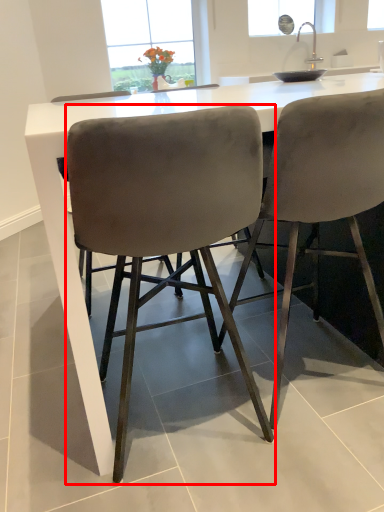
Question: Where is chair (annotated by the red box) located in relation to chair in the image?

Choices:
 (A) right
 (B) left

Answer: (B)